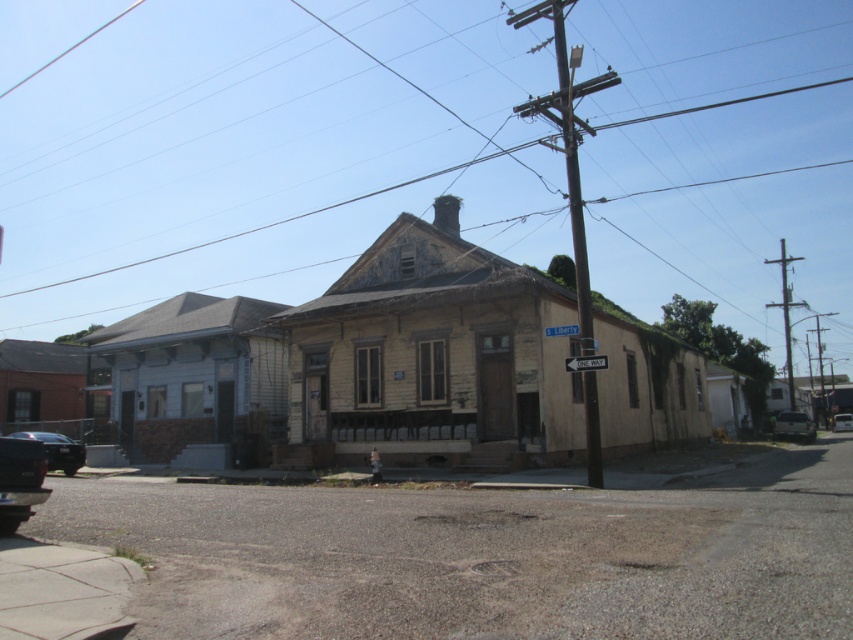
You are standing at the entrance of the house on the left. You want to park your car so that it is closest to the house on the right. Where should you position your car relative to the shiny black car at lower left?

To park closest to the house on the right, position your car to the right of the shiny black car at lower left since the shiny black car at lower left is located at point (19,481), which is closer to the house on the right than the house on the left.

You are a delivery driver who needs to park your truck between the shiny black sedan at lower left and the metallic silver car at lower right. Can you park your truck there if the truck is 2 meters wide?

The shiny black sedan at lower left is above metallic silver car at lower right, but the distance between them isn not specified. Without knowing the space between the two cars, it is impossible to determine if the truck can fit.

You are standing on the street looking at the two houses. There are two points marked on the image. Which point, point (6, 484) or point (45, 435), is closer to you?

Point (6, 484) is closer to the viewer than point (45, 435).